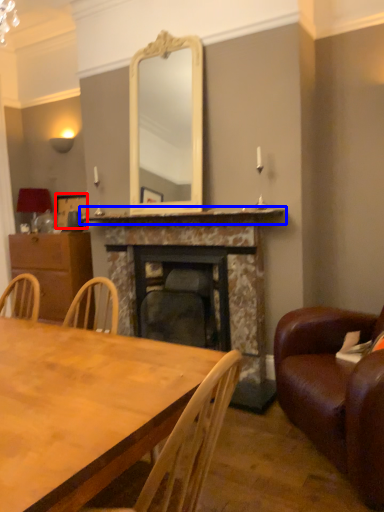
Question: Among these objects, which one is farthest to the camera, picture frame (highlighted by a red box) or mantle (highlighted by a blue box)?

Choices:
 (A) picture frame
 (B) mantle

Answer: (A)